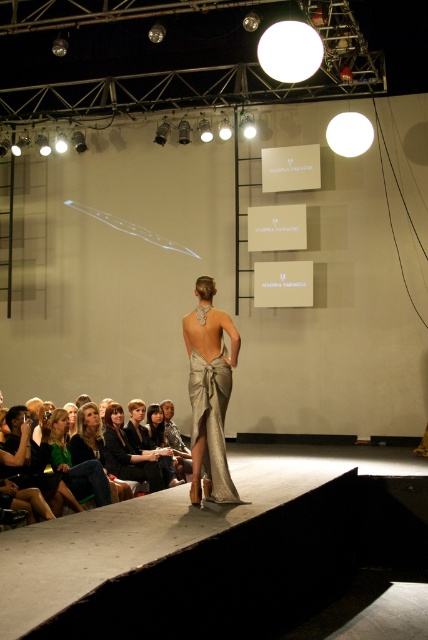
Question: Which object appears closest to the camera in this image?

Choices:
 (A) matte silver dress at center
 (B) matte black dress at center

Answer: (A)

Question: In this image, where is green fabric dress at lower left located relative to matte silver dress at center?

Choices:
 (A) right
 (B) left

Answer: (B)

Question: Does satin metallic dress at center appear over green fabric dress at lower left?

Choices:
 (A) no
 (B) yes

Answer: (B)

Question: Which point is farther to the camera?

Choices:
 (A) (119, 413)
 (B) (55, 417)

Answer: (A)

Question: Based on their relative distances, which object is farther from the satin metallic dress at center?

Choices:
 (A) green fabric dress at lower left
 (B) matte black dress at center
 (C) matte silver dress at center

Answer: (B)

Question: Is satin metallic dress at center to the left of green fabric dress at lower left from the viewer's perspective?

Choices:
 (A) yes
 (B) no

Answer: (B)